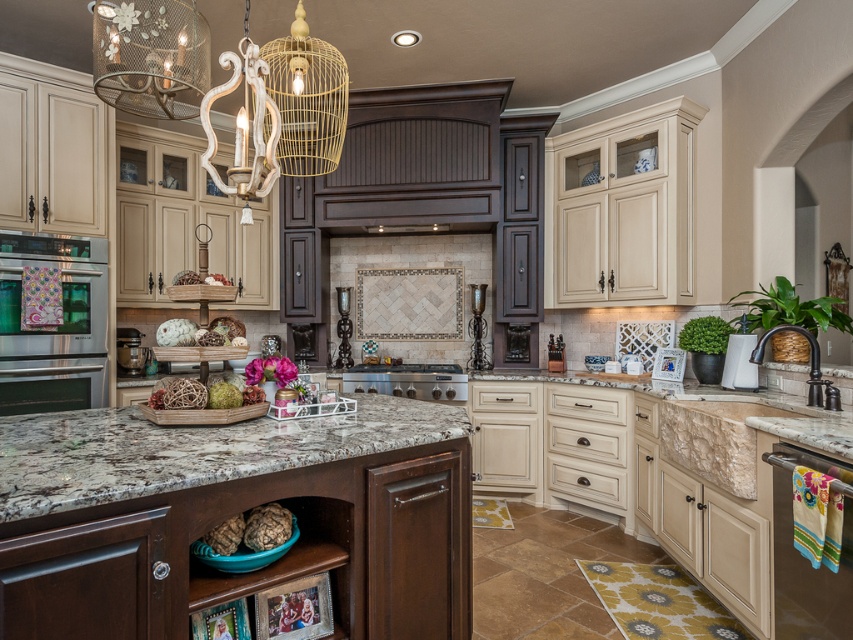
Who is more forward, [322,435] or [434,376]?

Point [322,435] is more forward.

Does granite at center appear on the right side of satin silver stove at center?

No, granite at center is not to the right of satin silver stove at center.

Is point (274, 420) positioned in front of point (415, 374)?

Yes, point (274, 420) is closer to viewer.

Find the location of a particular element. This screenshot has height=640, width=853. granite at center is located at coordinates (190, 449).

Is point (317, 81) closer to viewer compared to point (10, 269)?

No, (317, 81) is behind (10, 269).

Is gold wire mesh chandelier at upper center behind stainless steel oven at left?

No, gold wire mesh chandelier at upper center is closer to the viewer.

Which is behind, point (245, 148) or point (67, 256)?

Positioned behind is point (67, 256).

What are the coordinates of `gold wire mesh chandelier at upper center` in the screenshot? It's located at (225, 88).

Can you confirm if stainless steel oven at left is wider than metallic stainless steel dishwasher at lower right?

Yes.

At what (x,y) coordinates should I click in order to perform the action: click on stainless steel oven at left. Please return your answer as a coordinate pair (x, y). This screenshot has height=640, width=853. Looking at the image, I should click on (51, 324).

Find the location of a particular element. This screenshot has width=853, height=640. stainless steel oven at left is located at coordinates (51, 324).